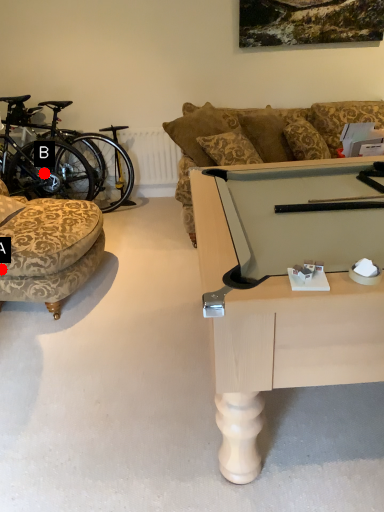
Question: Two points are circled on the image, labeled by A and B beside each circle. Which point appears farthest from the camera in this image?

Choices:
 (A) A is further
 (B) B is further

Answer: (B)